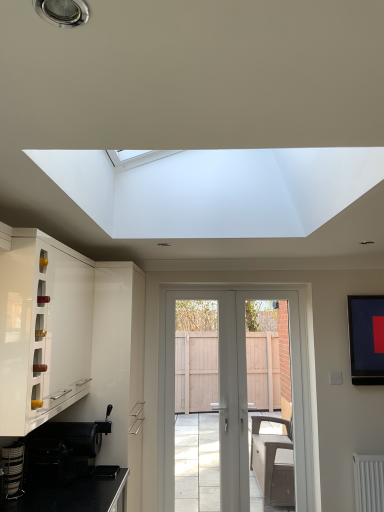
Question: Does white glossy cabinet at left have a smaller size compared to metallic silver coffee machine at lower left?

Choices:
 (A) no
 (B) yes

Answer: (A)

Question: Is white glossy cabinet at left wider than metallic silver coffee machine at lower left?

Choices:
 (A) no
 (B) yes

Answer: (B)

Question: Is white glossy cabinet at left located outside metallic silver coffee machine at lower left?

Choices:
 (A) yes
 (B) no

Answer: (A)

Question: Is white glossy cabinet at left at the right side of metallic silver coffee machine at lower left?

Choices:
 (A) no
 (B) yes

Answer: (B)

Question: From the image's perspective, is white glossy cabinet at left under metallic silver coffee machine at lower left?

Choices:
 (A) yes
 (B) no

Answer: (B)

Question: Is white glossy cabinet at left not near metallic silver coffee machine at lower left?

Choices:
 (A) no
 (B) yes

Answer: (A)

Question: From the image's perspective, is metallic silver coffee machine at lower left above white plastic screen door at center?

Choices:
 (A) yes
 (B) no

Answer: (A)

Question: Is metallic silver coffee machine at lower left looking in the opposite direction of white plastic screen door at center?

Choices:
 (A) yes
 (B) no

Answer: (B)

Question: Can you confirm if metallic silver coffee machine at lower left is thinner than white plastic screen door at center?

Choices:
 (A) no
 (B) yes

Answer: (B)

Question: Is metallic silver coffee machine at lower left completely or partially outside of white plastic screen door at center?

Choices:
 (A) no
 (B) yes

Answer: (B)

Question: Does metallic silver coffee machine at lower left have a smaller size compared to white plastic screen door at center?

Choices:
 (A) no
 (B) yes

Answer: (B)

Question: Does metallic silver coffee machine at lower left come in front of white plastic screen door at center?

Choices:
 (A) yes
 (B) no

Answer: (A)

Question: Is the position of white glossy cabinet at left less distant than that of white plastic screen door at center?

Choices:
 (A) yes
 (B) no

Answer: (A)